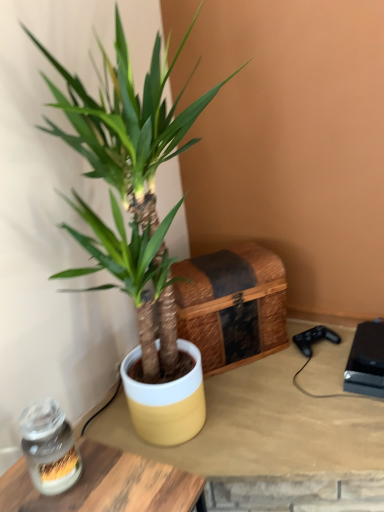
You are a GUI agent. You are given a task and a screenshot of the screen. Output one action in this format:
    pyautogui.click(x=<x>, y=<y>)
    Task: Click on the vacant area to the right of clear glass jar at lower left
    
    Given the screenshot: What is the action you would take?
    pyautogui.click(x=120, y=479)